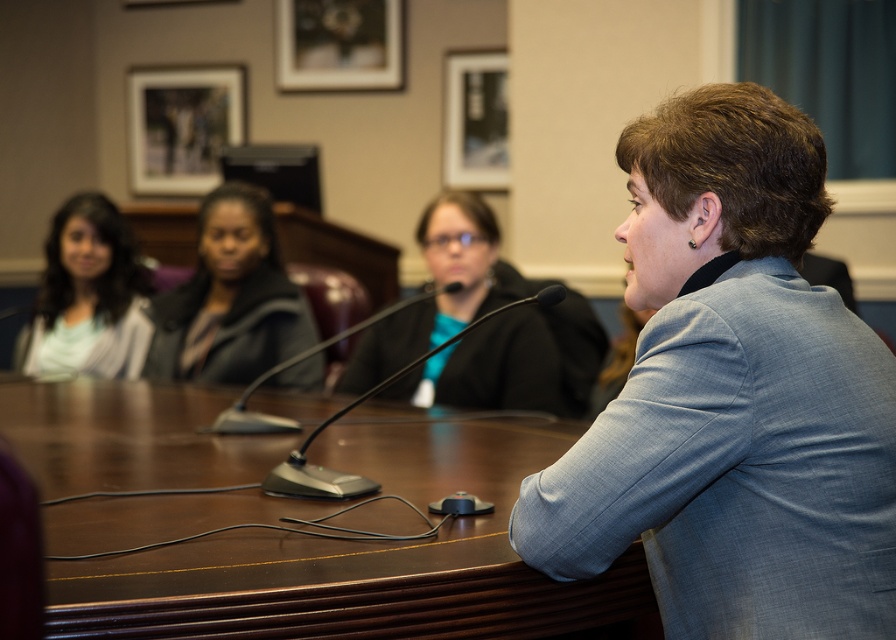
You are attending a formal meeting and need to place a document on the brown wood table at center. To ensure it is visible to everyone, where should you place it relative to the light blue shirt at left?

The brown wood table at center is positioned on the right side of the light blue shirt at left, so placing the document on the far right of the table would make it visible to everyone, including the person wearing the light blue shirt at left.

You are a photographer standing at the back of the room. You want to take a closeup photo of the blue textured blazer at center without including any other objects in the frame. Given that your camera has a 50mm lens, which has a typical focusing distance of 4 feet, can you capture the blazer clearly?

The blue textured blazer at center is 3.55 feet away from the camera, which is within the 4 feet focusing distance of a 50mm lens. Therefore, you can capture the blazer clearly without any issues.

You are an assistant at the event and need to locate the blue textured blazer at center. Where exactly should you look?

You should look at point (731, 396) to find the blue textured blazer at center.